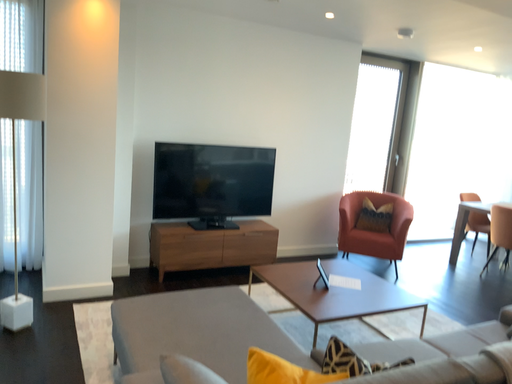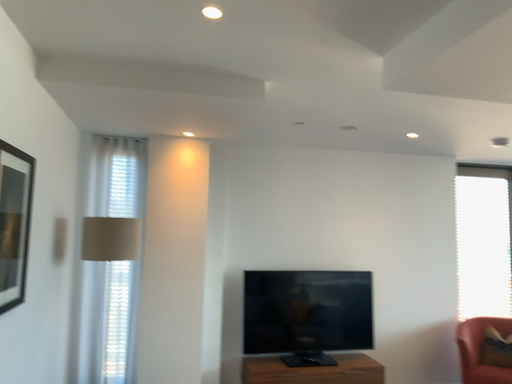
Question: How did the camera likely rotate when shooting the video?

Choices:
 (A) rotated right
 (B) rotated left

Answer: (B)